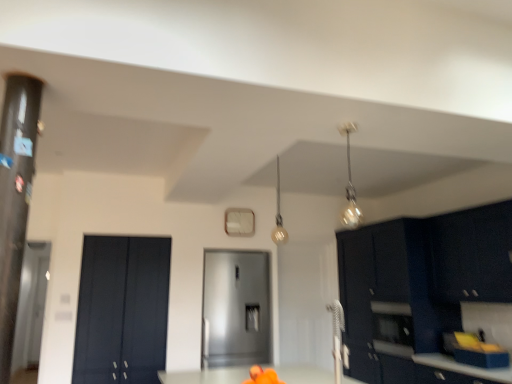
Where is `metallic glass pendant light at upper right, the second light fixture viewed from the left`? This screenshot has height=384, width=512. metallic glass pendant light at upper right, the second light fixture viewed from the left is located at coordinates (350, 185).

Locate an element on the screen. This screenshot has width=512, height=384. matte black cabinet at left, the 1th door when ordered from left to right is located at coordinates [122, 310].

What is the approximate width of matte gold light fixture at upper center, marked as the 2th light fixture in a right-to-left arrangement?

5.62 inches.

You are a GUI agent. You are given a task and a screenshot of the screen. Output one action in this format:
    pyautogui.click(x=<x>, y=<y>)
    Task: Click on the satin metallic refrigerator at center, arranged as the 1th door when viewed from the right
    The image size is (512, 384).
    Given the screenshot: What is the action you would take?
    pyautogui.click(x=234, y=308)

Image resolution: width=512 pixels, height=384 pixels. Find the location of `metallic glass pendant light at upper right, the second light fixture viewed from the left`. metallic glass pendant light at upper right, the second light fixture viewed from the left is located at coordinates (350, 185).

How different are the orientations of metallic glass pendant light at upper right, the second light fixture in the back-to-front sequence, and matte black cabinet at left, acting as the second door starting from the right, in degrees?

The facing directions of metallic glass pendant light at upper right, the second light fixture in the back-to-front sequence, and matte black cabinet at left, acting as the second door starting from the right, are 2.51 degrees apart.

Between point (346, 185) and point (155, 262), which one is positioned in front?

The point (155, 262) is closer to the camera.

From the image's perspective, is metallic glass pendant light at upper right, the second light fixture in the back-to-front sequence, above or below matte black cabinet at left, acting as the second door starting from the right?

metallic glass pendant light at upper right, the second light fixture in the back-to-front sequence, is situated higher than matte black cabinet at left, acting as the second door starting from the right, in the image.

Is metallic glass pendant light at upper right, the second light fixture in the back-to-front sequence, not near matte black cabinet at left, the 1th door when ordered from left to right?

Yes.

Is satin metallic refrigerator at center, the 2th door in the left-to-right sequence, facing away from metallic glass pendant light at upper right, marked as the 1th light fixture in a front-to-back arrangement?

satin metallic refrigerator at center, the 2th door in the left-to-right sequence, does not have its back to metallic glass pendant light at upper right, marked as the 1th light fixture in a front-to-back arrangement.

Is satin metallic refrigerator at center, arranged as the 1th door when viewed from the right, situated inside metallic glass pendant light at upper right, acting as the first light fixture starting from the right, or outside?

satin metallic refrigerator at center, arranged as the 1th door when viewed from the right, is not inside metallic glass pendant light at upper right, acting as the first light fixture starting from the right, it's outside.

Between satin metallic refrigerator at center, the 2th door in the left-to-right sequence, and metallic glass pendant light at upper right, marked as the 1th light fixture in a front-to-back arrangement, which one has more height?

With more height is satin metallic refrigerator at center, the 2th door in the left-to-right sequence.

Considering the positions of objects satin metallic refrigerator at center, arranged as the 1th door when viewed from the right, and metallic glass pendant light at upper right, the second light fixture viewed from the left, in the image provided, who is more to the right, satin metallic refrigerator at center, arranged as the 1th door when viewed from the right, or metallic glass pendant light at upper right, the second light fixture viewed from the left,?

From the viewer's perspective, metallic glass pendant light at upper right, the second light fixture viewed from the left, appears more on the right side.

Would you say matte gold light fixture at upper center, marked as the first light fixture in a left-to-right arrangement, is part of satin metallic refrigerator at center, the 2th door in the left-to-right sequence,'s contents?

No, matte gold light fixture at upper center, marked as the first light fixture in a left-to-right arrangement, is not surrounded by satin metallic refrigerator at center, the 2th door in the left-to-right sequence.

Image resolution: width=512 pixels, height=384 pixels. Identify the location of light fixture that is the 1st one when counting upward from the satin metallic refrigerator at center, arranged as the 1th door when viewed from the right (from the image's perspective). point(279,216).

From the image's perspective, which is below, satin metallic refrigerator at center, arranged as the 1th door when viewed from the right, or matte gold light fixture at upper center, marked as the 2th light fixture in a right-to-left arrangement?

satin metallic refrigerator at center, arranged as the 1th door when viewed from the right, is shown below in the image.

In terms of height, does satin metallic refrigerator at center, arranged as the 1th door when viewed from the right, look taller or shorter compared to matte gold light fixture at upper center, marked as the first light fixture in a left-to-right arrangement?

Clearly, satin metallic refrigerator at center, arranged as the 1th door when viewed from the right, is taller compared to matte gold light fixture at upper center, marked as the first light fixture in a left-to-right arrangement.

Which is closer to the camera, (358, 217) or (260, 278)?

Point (358, 217) is farther from the camera than point (260, 278).

Does metallic glass pendant light at upper right, the second light fixture in the back-to-front sequence, have a greater height compared to satin metallic refrigerator at center, arranged as the 1th door when viewed from the right?

Incorrect, the height of metallic glass pendant light at upper right, the second light fixture in the back-to-front sequence, is not larger of that of satin metallic refrigerator at center, arranged as the 1th door when viewed from the right.

From a real-world perspective, between metallic glass pendant light at upper right, acting as the first light fixture starting from the right, and satin metallic refrigerator at center, the 2th door in the left-to-right sequence, who is vertically higher?

metallic glass pendant light at upper right, acting as the first light fixture starting from the right, is physically above.

Is transparent glass door at left oriented away from matte black cabinet at left, the 1th door when ordered from left to right?

transparent glass door at left is not turned away from matte black cabinet at left, the 1th door when ordered from left to right.

Considering the relative sizes of transparent glass door at left and matte black cabinet at left, acting as the second door starting from the right, in the image provided, is transparent glass door at left wider than matte black cabinet at left, acting as the second door starting from the right,?

Correct, the width of transparent glass door at left exceeds that of matte black cabinet at left, acting as the second door starting from the right.

How different are the orientations of transparent glass door at left and matte black cabinet at left, acting as the second door starting from the right, in degrees?

The facing directions of transparent glass door at left and matte black cabinet at left, acting as the second door starting from the right, are 1.06 degrees apart.

Would you say transparent glass door at left is outside matte black cabinet at left, the 1th door when ordered from left to right?

Indeed, transparent glass door at left is completely outside matte black cabinet at left, the 1th door when ordered from left to right.

In terms of width, does satin metallic refrigerator at center, the 2th door in the left-to-right sequence, look wider or thinner when compared to transparent glass door at left?

Considering their sizes, satin metallic refrigerator at center, the 2th door in the left-to-right sequence, looks broader than transparent glass door at left.

Is point (231, 361) closer to viewer compared to point (30, 256)?

Yes, it is in front of point (30, 256).

Which is more to the right, satin metallic refrigerator at center, the 2th door in the left-to-right sequence, or transparent glass door at left?

Positioned to the right is satin metallic refrigerator at center, the 2th door in the left-to-right sequence.

Are satin metallic refrigerator at center, arranged as the 1th door when viewed from the right, and transparent glass door at left far apart?

Indeed, satin metallic refrigerator at center, arranged as the 1th door when viewed from the right, is not near transparent glass door at left.

Is matte black cabinet at left, acting as the second door starting from the right, at the back of matte gold light fixture at upper center, placed as the 2th light fixture when sorted from front to back?

No, matte gold light fixture at upper center, placed as the 2th light fixture when sorted from front to back, is not facing the opposite direction of matte black cabinet at left, acting as the second door starting from the right.

Is matte gold light fixture at upper center, placed as the 2th light fixture when sorted from front to back, not close to matte black cabinet at left, the 1th door when ordered from left to right?

Indeed, matte gold light fixture at upper center, placed as the 2th light fixture when sorted from front to back, is not near matte black cabinet at left, the 1th door when ordered from left to right.

From the image's perspective, is matte gold light fixture at upper center, marked as the 2th light fixture in a right-to-left arrangement, on matte black cabinet at left, the 1th door when ordered from left to right?

Indeed, from the image's perspective, matte gold light fixture at upper center, marked as the 2th light fixture in a right-to-left arrangement, is shown above matte black cabinet at left, the 1th door when ordered from left to right.

Find the location of a particular element. the 2nd door to the left of the matte gold light fixture at upper center, which ranks as the 1th light fixture in back-to-front order, starting your count from the anchor is located at coordinates (122, 310).

Image resolution: width=512 pixels, height=384 pixels. What are the coordinates of `the 1st door positioned below the metallic glass pendant light at upper right, the second light fixture viewed from the left (from the image's perspective)` in the screenshot? It's located at (122, 310).

You are a GUI agent. You are given a task and a screenshot of the screen. Output one action in this format:
    pyautogui.click(x=<x>, y=<y>)
    Task: Click on the door that is the 2nd one when counting backward from the metallic glass pendant light at upper right, marked as the 1th light fixture in a front-to-back arrangement
    The width and height of the screenshot is (512, 384).
    Given the screenshot: What is the action you would take?
    pyautogui.click(x=234, y=308)

From the image, which object appears to be farther from glossy dark blue cabinet at upper right, arranged as the 2th cabinetry when viewed from the back, metallic glass pendant light at upper right, the second light fixture viewed from the left, or matte black cabinets at right, which ranks as the 2th cabinetry in front-to-back order?

metallic glass pendant light at upper right, the second light fixture viewed from the left, is positioned further to the anchor glossy dark blue cabinet at upper right, arranged as the 2th cabinetry when viewed from the back.

In the scene shown: From the image, which object appears to be farther from satin metallic refrigerator at center, the 2th door in the left-to-right sequence, glossy dark blue cabinet at upper right, arranged as the 2th cabinetry when viewed from the back, or matte gold light fixture at upper center, marked as the first light fixture in a left-to-right arrangement?

glossy dark blue cabinet at upper right, arranged as the 2th cabinetry when viewed from the back, lies further to satin metallic refrigerator at center, the 2th door in the left-to-right sequence, than the other object.

Which object lies nearer to the anchor point transparent glass door at left, matte black cabinet at left, the 1th door when ordered from left to right, or satin metallic refrigerator at center, arranged as the 1th door when viewed from the right?

The object closer to transparent glass door at left is matte black cabinet at left, the 1th door when ordered from left to right.

From the image, which object appears to be nearer to matte black cabinets at right, which ranks as the 2th cabinetry in front-to-back order, matte gold light fixture at upper center, placed as the 2th light fixture when sorted from front to back, or metallic glass pendant light at upper right, acting as the first light fixture starting from the right?

Based on the image, metallic glass pendant light at upper right, acting as the first light fixture starting from the right, appears to be nearer to matte black cabinets at right, which ranks as the 2th cabinetry in front-to-back order.

Estimate the real-world distances between objects in this image. Which object is closer to matte black cabinet at left, the 1th door when ordered from left to right, matte gold light fixture at upper center, marked as the first light fixture in a left-to-right arrangement, or metallic glass pendant light at upper right, the second light fixture viewed from the left?

The object closer to matte black cabinet at left, the 1th door when ordered from left to right, is matte gold light fixture at upper center, marked as the first light fixture in a left-to-right arrangement.

Based on the photo, from the image, which object appears to be nearer to matte black cabinet at left, acting as the second door starting from the right, matte gold light fixture at upper center, marked as the first light fixture in a left-to-right arrangement, or glossy dark blue cabinet at upper right, the first cabinetry viewed from the front?

Among the two, matte gold light fixture at upper center, marked as the first light fixture in a left-to-right arrangement, is located nearer to matte black cabinet at left, acting as the second door starting from the right.

From the image, which object appears to be farther from satin metallic refrigerator at center, the 2th door in the left-to-right sequence, transparent glass door at left or matte black cabinets at right, which ranks as the 2th cabinetry in front-to-back order?

The object further to satin metallic refrigerator at center, the 2th door in the left-to-right sequence, is transparent glass door at left.

Which object lies nearer to the anchor point glossy dark blue cabinet at upper right, arranged as the 2th cabinetry when viewed from the back, matte black cabinets at right, arranged as the 1th cabinetry when viewed from the back, or matte black cabinet at left, the 1th door when ordered from left to right?

matte black cabinets at right, arranged as the 1th cabinetry when viewed from the back, is positioned closer to the anchor glossy dark blue cabinet at upper right, arranged as the 2th cabinetry when viewed from the back.

Locate an element on the screen. The width and height of the screenshot is (512, 384). door situated between matte black cabinet at left, the 1th door when ordered from left to right, and matte black cabinets at right, which ranks as the 2th cabinetry in front-to-back order, from left to right is located at coordinates (234, 308).

This screenshot has height=384, width=512. I want to click on light fixture located between matte black cabinet at left, the 1th door when ordered from left to right, and metallic glass pendant light at upper right, acting as the first light fixture starting from the right, in the left-right direction, so click(279, 216).

Where is `light fixture between metallic glass pendant light at upper right, the second light fixture in the back-to-front sequence, and satin metallic refrigerator at center, arranged as the 1th door when viewed from the right, from front to back`? light fixture between metallic glass pendant light at upper right, the second light fixture in the back-to-front sequence, and satin metallic refrigerator at center, arranged as the 1th door when viewed from the right, from front to back is located at coordinates (279, 216).

Find the location of a particular element. cabinetry between matte gold light fixture at upper center, placed as the 2th light fixture when sorted from front to back, and glossy dark blue cabinet at upper right, arranged as the 2th cabinetry when viewed from the back, from left to right is located at coordinates (426, 294).